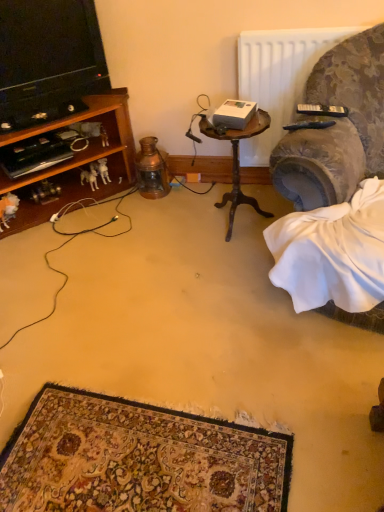
Describe the element at coordinates (310, 125) in the screenshot. This screenshot has height=512, width=384. I see `black plastic remote control at upper right, the 2th remote control when ordered from back to front` at that location.

In order to face wooden table at center, should I rotate leftwards or rightwards?

Turn right by 5.692 degrees to look at wooden table at center.

Identify the location of wooden table at center. (238, 162).

Locate an element on the screen. This screenshot has height=512, width=384. black cable at left is located at coordinates (67, 243).

Locate an element on the screen. This screenshot has width=384, height=512. black plastic remote control at upper right, the second remote control from the front is located at coordinates (322, 110).

In order to click on velvet fabric couch at right in this screenshot , I will do `click(337, 127)`.

Does velvet fabric couch at right have a smaller size compared to black plastic remote control at upper right, acting as the first remote control starting from the top?

No, velvet fabric couch at right is not smaller than black plastic remote control at upper right, acting as the first remote control starting from the top.

Do you think velvet fabric couch at right is within black plastic remote control at upper right, which ranks as the 1th remote control in back-to-front order, or outside of it?

velvet fabric couch at right is outside black plastic remote control at upper right, which ranks as the 1th remote control in back-to-front order.

Between velvet fabric couch at right and black plastic remote control at upper right, which ranks as the 1th remote control in back-to-front order, which one has larger width?

With larger width is velvet fabric couch at right.

From a real-world perspective, is velvet fabric couch at right physically below black plastic remote control at upper right, which ranks as the 1th remote control in back-to-front order?

Yes, from a real-world perspective, velvet fabric couch at right is beneath black plastic remote control at upper right, which ranks as the 1th remote control in back-to-front order.

From the image's perspective, between white fabric at lower right and wooden table at center, who is located below?

white fabric at lower right.

Consider the image. Does white fabric at lower right have a larger size compared to wooden table at center?

Indeed, white fabric at lower right has a larger size compared to wooden table at center.

Is wooden table at center at the back of white fabric at lower right?

No, wooden table at center is not at the back of white fabric at lower right.

Which is in front, point (328, 124) or point (133, 188)?

The point (328, 124) is closer.

Can you see black plastic remote control at upper right, the 2th remote control when ordered from back to front, touching black cable at left?

Result: No, black plastic remote control at upper right, the 2th remote control when ordered from back to front, is not with black cable at left.

In terms of width, does black plastic remote control at upper right, the 2th remote control when ordered from back to front, look wider or thinner when compared to black cable at left?

Clearly, black plastic remote control at upper right, the 2th remote control when ordered from back to front, has less width compared to black cable at left.

From the image's perspective, count 1st remote controls upward from the black cable at left and point to it. Please provide its 2D coordinates.

[(310, 125)]

Can you confirm if velvet fabric couch at right is wider than black glossy television at upper left?

Incorrect, the width of velvet fabric couch at right does not surpass that of black glossy television at upper left.

Can you tell me how much velvet fabric couch at right and black glossy television at upper left differ in facing direction?

The angle between the facing direction of velvet fabric couch at right and the facing direction of black glossy television at upper left is 40.5 degrees.

Locate an element on the screen. Image resolution: width=384 pixels, height=512 pixels. studio couch below the black glossy television at upper left (from the image's perspective) is located at coordinates (337, 127).

Does point (312, 101) come closer to viewer compared to point (1, 98)?

Yes.

From the picture: From a real-world perspective, between white plastic dog at lower left and white fabric at lower right, who is vertically higher?

white fabric at lower right.

Is white plastic dog at lower left to the right of white fabric at lower right from the viewer's perspective?

Incorrect, white plastic dog at lower left is not on the right side of white fabric at lower right.

Which object is thinner, white plastic dog at lower left or white fabric at lower right?

white plastic dog at lower left is thinner.

Consider the image. Is white plastic dog at lower left facing towards white fabric at lower right?

Yes, white plastic dog at lower left is facing white fabric at lower right.

From the image's perspective, is white fabric at lower right above or below velvet fabric couch at right?

white fabric at lower right is below velvet fabric couch at right.

Are white fabric at lower right and velvet fabric couch at right far apart?

No, white fabric at lower right is not far away from velvet fabric couch at right.

Choose the correct answer: Is white fabric at lower right inside velvet fabric couch at right or outside it?

white fabric at lower right is not inside velvet fabric couch at right, it's outside.

Image resolution: width=384 pixels, height=512 pixels. Identify the location of bedding that appears below the velvet fabric couch at right (from the image's perspective). (334, 257).

Is black glossy television at upper left shorter than white plastic dog at lower left?

In fact, black glossy television at upper left may be taller than white plastic dog at lower left.

Is black glossy television at upper left positioned far away from white plastic dog at lower left?

No, black glossy television at upper left is not far away from white plastic dog at lower left.

Which of these two, black glossy television at upper left or white plastic dog at lower left, is wider?

white plastic dog at lower left is wider.

From the image's perspective, between black glossy television at upper left and white plastic dog at lower left, which one is located above?

black glossy television at upper left.

The width and height of the screenshot is (384, 512). I want to click on the 1st remote control in front of the velvet fabric couch at right, so click(x=322, y=110).

You are a GUI agent. You are given a task and a screenshot of the screen. Output one action in this format:
    pyautogui.click(x=<x>, y=<y>)
    Task: Click on the desk located above the white fabric at lower right (from a real-world perspective)
    The width and height of the screenshot is (384, 512).
    Given the screenshot: What is the action you would take?
    pyautogui.click(x=238, y=162)

Which object lies further to the anchor point wooden table at center, white fabric at lower right or black cable at left?

white fabric at lower right is further to wooden table at center.

When comparing their distances from wooden table at center, does black plastic remote control at upper right, which ranks as the 1th remote control in back-to-front order, or velvet fabric couch at right seem closer?

Based on the image, black plastic remote control at upper right, which ranks as the 1th remote control in back-to-front order, appears to be nearer to wooden table at center.

Looking at the image, which one is located closer to wooden table at center, white plastic dog at lower left or white fabric at lower right?

white fabric at lower right is closer to wooden table at center.

Looking at this image, estimate the real-world distances between objects in this image. Which object is closer to black cable at left, wooden table at center or white plastic dog at lower left?

The object closer to black cable at left is white plastic dog at lower left.

From the image, which object appears to be nearer to black plastic remote control at upper right, acting as the first remote control starting from the top, black cable at left or black plastic remote control at upper right, the 1th remote control from the bottom?

The object closer to black plastic remote control at upper right, acting as the first remote control starting from the top, is black plastic remote control at upper right, the 1th remote control from the bottom.

Estimate the real-world distances between objects in this image. Which object is further from black plastic remote control at upper right, acting as the first remote control starting from the top, velvet fabric couch at right or black cable at left?

Among the two, black cable at left is located further to black plastic remote control at upper right, acting as the first remote control starting from the top.

Looking at the image, which one is located further to black plastic remote control at upper right, acting as the first remote control starting from the top, white plastic dog at lower left or wooden table at center?

The object further to black plastic remote control at upper right, acting as the first remote control starting from the top, is white plastic dog at lower left.

From the image, which object appears to be nearer to black cable at left, white plastic dog at lower left or velvet fabric couch at right?

Based on the image, white plastic dog at lower left appears to be nearer to black cable at left.

Locate an element on the screen. animal between black glossy television at upper left and velvet fabric couch at right in the horizontal direction is located at coordinates (89, 178).

This screenshot has height=512, width=384. In order to click on desk between black cable at left and velvet fabric couch at right in this screenshot , I will do `click(238, 162)`.

The width and height of the screenshot is (384, 512). In order to click on studio couch between white plastic dog at lower left and white fabric at lower right from left to right in this screenshot , I will do `click(337, 127)`.

The height and width of the screenshot is (512, 384). Find the location of `desk situated between black glossy television at upper left and velvet fabric couch at right from left to right`. desk situated between black glossy television at upper left and velvet fabric couch at right from left to right is located at coordinates (238, 162).